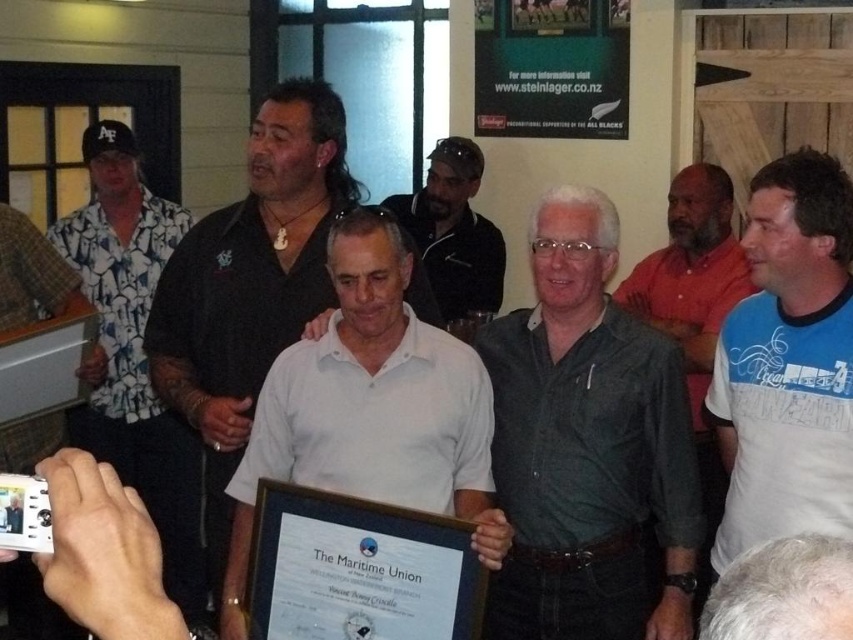
Question: Which point is closer to the camera taking this photo?

Choices:
 (A) (479, 300)
 (B) (772, 541)
 (C) (340, 317)

Answer: (B)

Question: Which point is farther from the camera taking this photo?

Choices:
 (A) (496, 307)
 (B) (148, 236)
 (C) (840, 236)
 (D) (438, 449)

Answer: (A)

Question: Which object appears farthest from the camera in this image?

Choices:
 (A) matte black shirt at center
 (B) blue printed t-shirt at right
 (C) green textured shirt at center
 (D) white printed shirt at left

Answer: (D)

Question: Does green textured shirt at center have a greater width compared to gray hair at center?

Choices:
 (A) yes
 (B) no

Answer: (A)

Question: Does white matte shirt at center appear over matte black shirt at center?

Choices:
 (A) yes
 (B) no

Answer: (B)

Question: Is green textured shirt at center to the right of gray hair at center from the viewer's perspective?

Choices:
 (A) no
 (B) yes

Answer: (B)